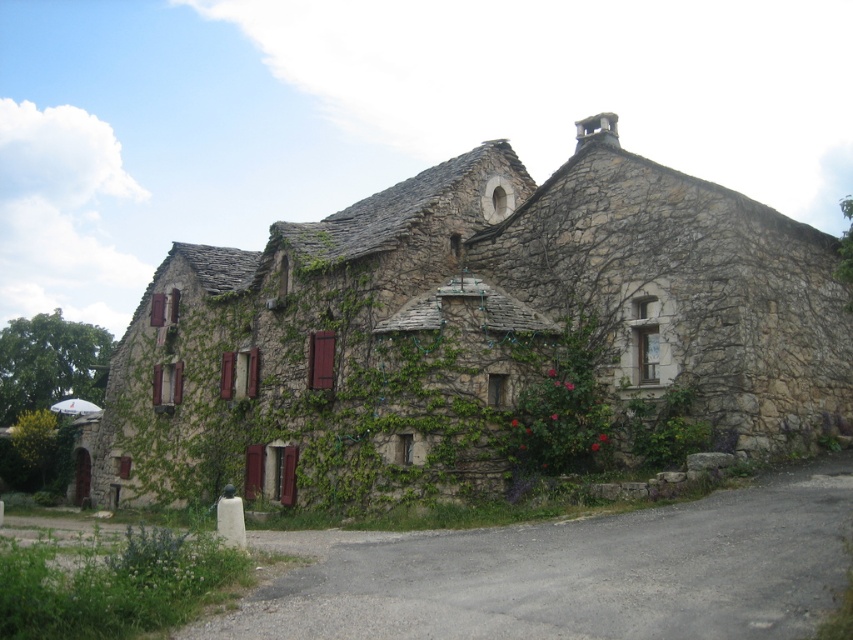
Image resolution: width=853 pixels, height=640 pixels. Describe the element at coordinates (477, 337) in the screenshot. I see `natural stone cottage at center` at that location.

Does natural stone cottage at center lie in front of gray asphalt driveway at lower center?

No, natural stone cottage at center is further to the viewer.

Which is in front, point (752, 202) or point (502, 595)?

Point (502, 595) is in front.

Find the location of a particular element. This screenshot has width=853, height=640. natural stone cottage at center is located at coordinates (477, 337).